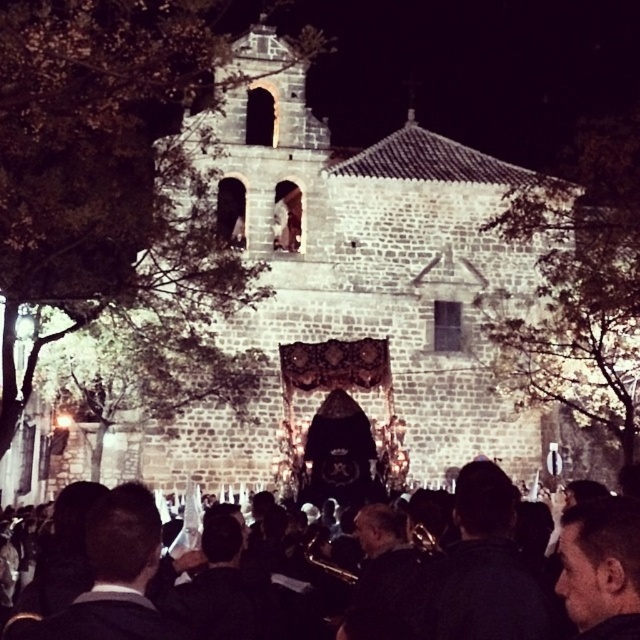
Question: Where is stone church at center located in relation to black fabric crowd at lower center in the image?

Choices:
 (A) left
 (B) right

Answer: (A)

Question: Which of the following is the closest to the observer?

Choices:
 (A) black fabric crowd at lower center
 (B) stone church at center

Answer: (A)

Question: Can you confirm if stone church at center is positioned to the right of black fabric crowd at lower center?

Choices:
 (A) no
 (B) yes

Answer: (A)

Question: Does stone church at center have a greater width compared to black fabric crowd at lower center?

Choices:
 (A) yes
 (B) no

Answer: (A)